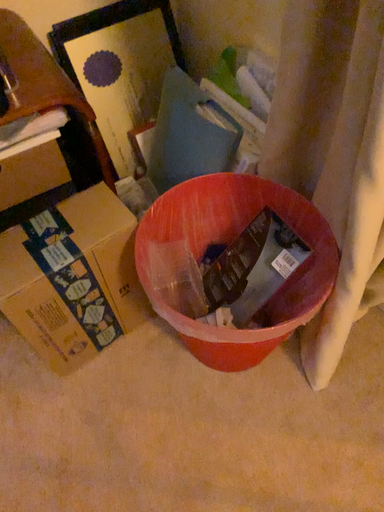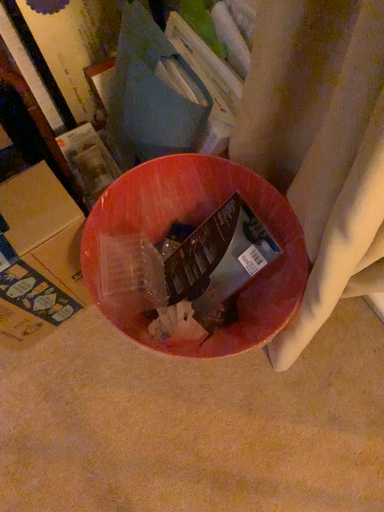
Question: Which way did the camera rotate in the video?

Choices:
 (A) rotated downward
 (B) rotated upward

Answer: (A)